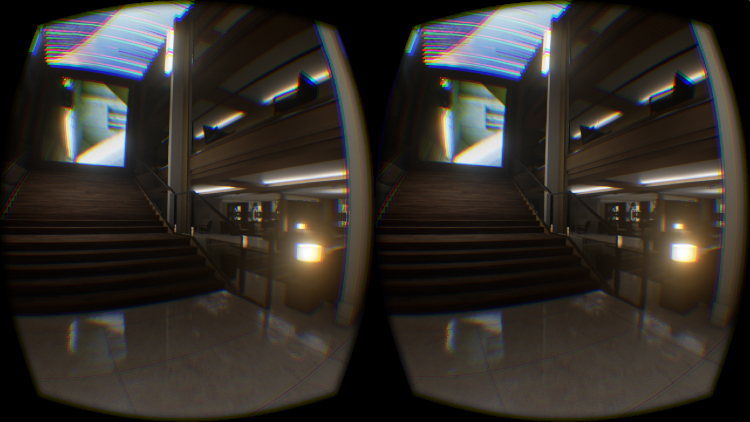
The height and width of the screenshot is (422, 750). Find the location of `ceiling light`. ceiling light is located at coordinates (699, 176).